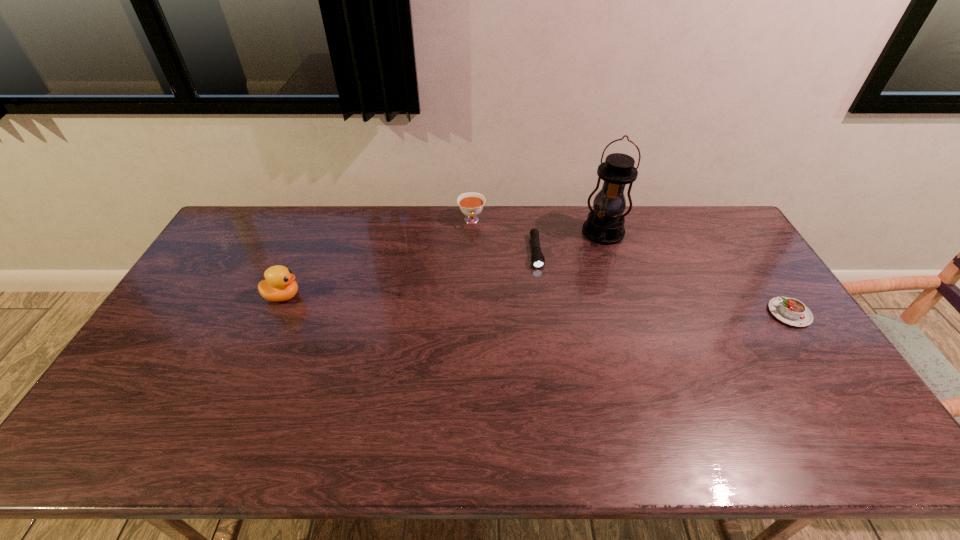
Where is `empty location between the third tallest object and the third object from right to left`? The width and height of the screenshot is (960, 540). empty location between the third tallest object and the third object from right to left is located at coordinates (504, 237).

Identify the location of unoccupied position between the duckling and the lantern. This screenshot has height=540, width=960. (444, 265).

Where is `free space between the leftmost object and the third object from left to right`? Image resolution: width=960 pixels, height=540 pixels. free space between the leftmost object and the third object from left to right is located at coordinates [x=409, y=274].

The image size is (960, 540). Find the location of `unoccupied area between the leftmost object and the fourth object from left to right`. unoccupied area between the leftmost object and the fourth object from left to right is located at coordinates coord(444,265).

This screenshot has height=540, width=960. Find the location of `free spot between the duckling and the flashlight`. free spot between the duckling and the flashlight is located at coordinates (409, 274).

Where is `vacant area that lies between the second object from right to left and the third shortest object`? vacant area that lies between the second object from right to left and the third shortest object is located at coordinates click(x=538, y=227).

Locate an element on the screen. vacant region between the duckling and the pudding is located at coordinates (536, 305).

This screenshot has width=960, height=540. In order to click on object that is the fourth closest one to the teacup in this screenshot , I will do `click(791, 311)`.

Image resolution: width=960 pixels, height=540 pixels. In order to click on the second closest object relative to the fourth shortest object in this screenshot , I will do `click(537, 258)`.